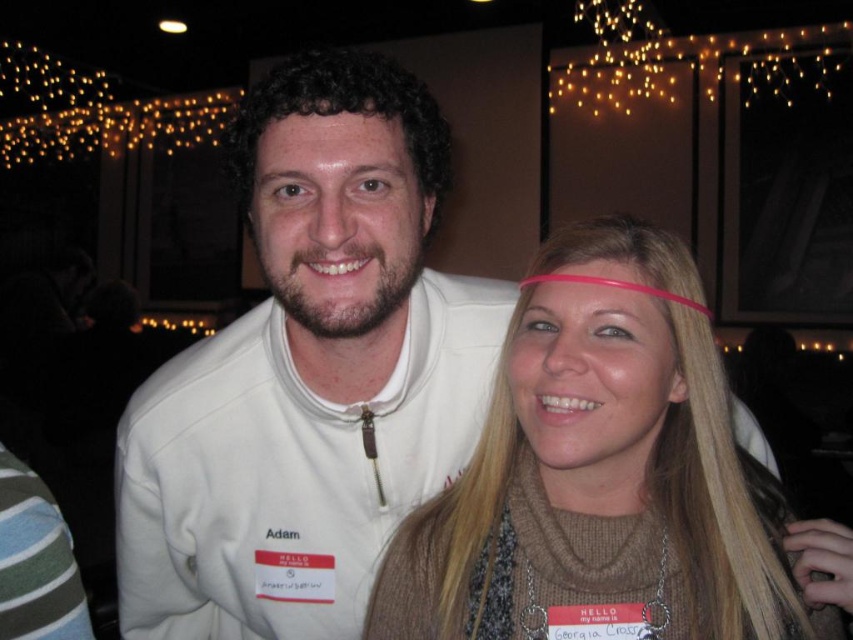
You are standing at the position of the photographer who took the picture. You need to place a small decorative item exactly halfway between the two points shown in the image. Which point is closer to the photographer? The two points are point (x=297, y=381) and point (x=708, y=412). Please choose between them.

Point (x=708, y=412) is closer to the photographer because it is in front of point (x=297, y=381), so placing the item halfway between them would require knowing their depth positions.

You are a photographer trying to frame a portrait of the two people in the scene. You want to ensure that both the blonde hair at center and the shiny skin forehead at center are clearly visible in the shot. Based on their sizes, which object should you focus on to ensure both are in focus?

The blonde hair at center is wider than the shiny skin forehead at center, so focusing on the wider object will increase the chances of both being in focus.

Consider the image. You are a photographer adjusting the camera focus. You notice the white fleece jacket at center and the shiny skin forehead at center. Which object should you focus on first to ensure both are in sharp focus?

The white fleece jacket at center is located below shiny skin forehead at center, so you should focus on the shiny skin forehead at center first to ensure both are in sharp focus.